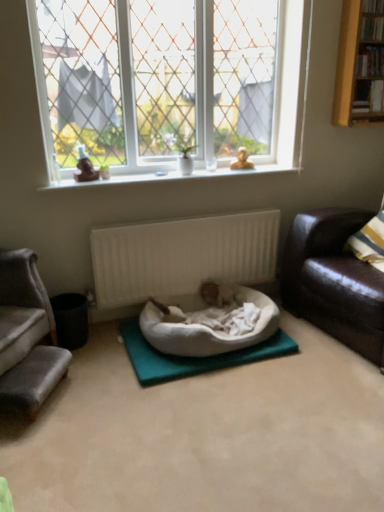
Identify the location of free location in front of white fabric yoga mat at center. Image resolution: width=384 pixels, height=512 pixels. (218, 423).